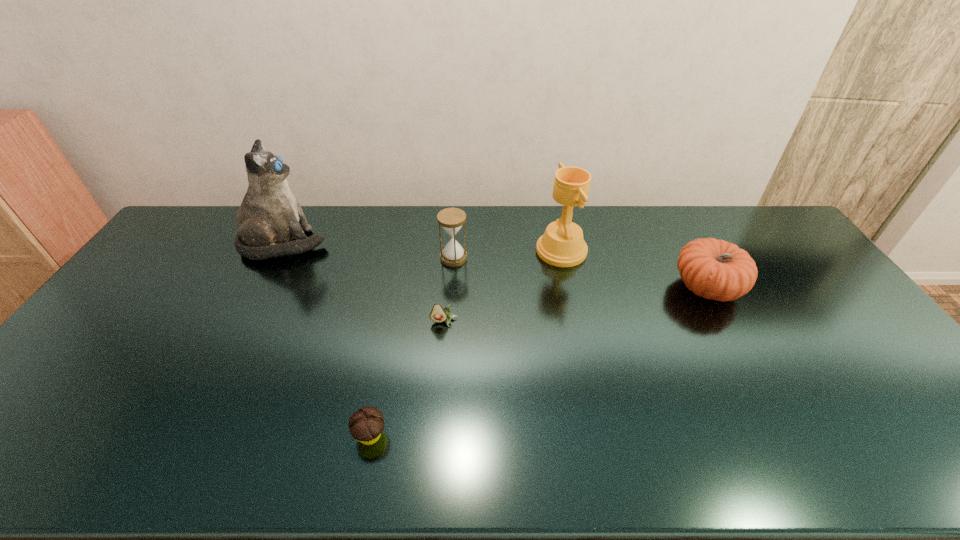
Identify the location of free space located at the face of the leftmost object. The image size is (960, 540). (368, 244).

I want to click on free space located 0.320m on the front of the award, so click(583, 350).

You are a GUI agent. You are given a task and a screenshot of the screen. Output one action in this format:
    pyautogui.click(x=<x>, y=<y>)
    Task: Click on the free space located on the left of the hourglass
    The image size is (960, 540).
    Given the screenshot: What is the action you would take?
    pyautogui.click(x=417, y=258)

Identify the location of blank area located 0.200m on the left of the rightmost object. The image size is (960, 540). (608, 288).

Locate an element on the screen. The height and width of the screenshot is (540, 960). vacant space located on the seed side of the second nearest object is located at coordinates (437, 406).

Identify the location of free space located 0.120m on the left of the muffin. (301, 435).

The image size is (960, 540). Identify the location of cat located in the far edge section of the desktop. (269, 217).

Where is `award at the far edge`? award at the far edge is located at coordinates (562, 245).

The image size is (960, 540). Find the location of `object that is positioned at the near edge`. object that is positioned at the near edge is located at coordinates (365, 425).

In the image, there is a desktop. Identify the location of blank space at the far edge. (228, 222).